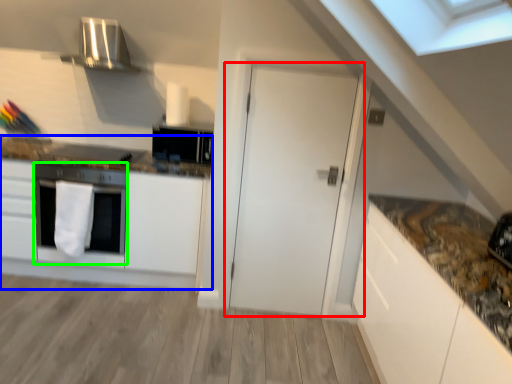
Question: Estimate the real-world distances between objects in this image. Which object is farther from door (highlighted by a red box), cabinetry (highlighted by a blue box) or oven (highlighted by a green box)?

Choices:
 (A) cabinetry
 (B) oven

Answer: (B)